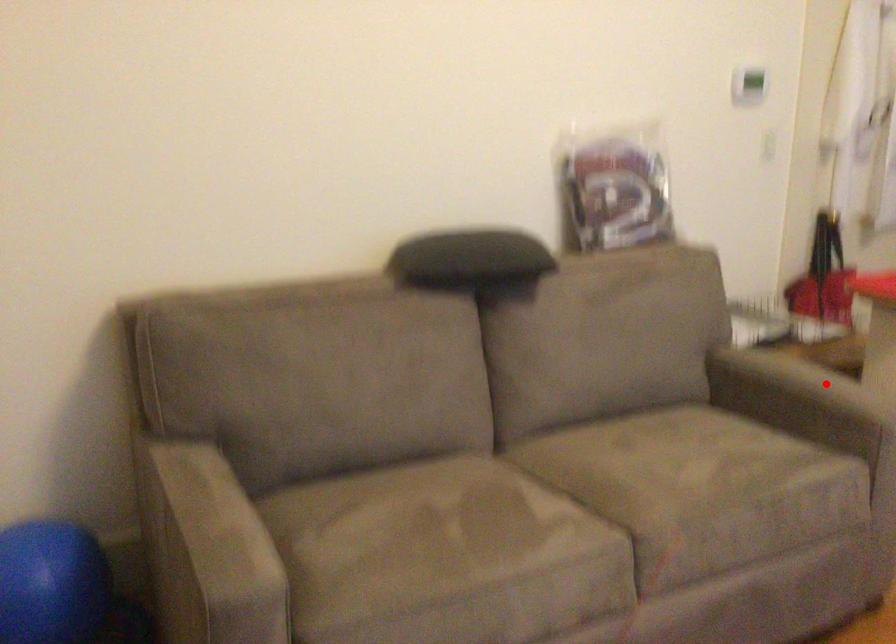
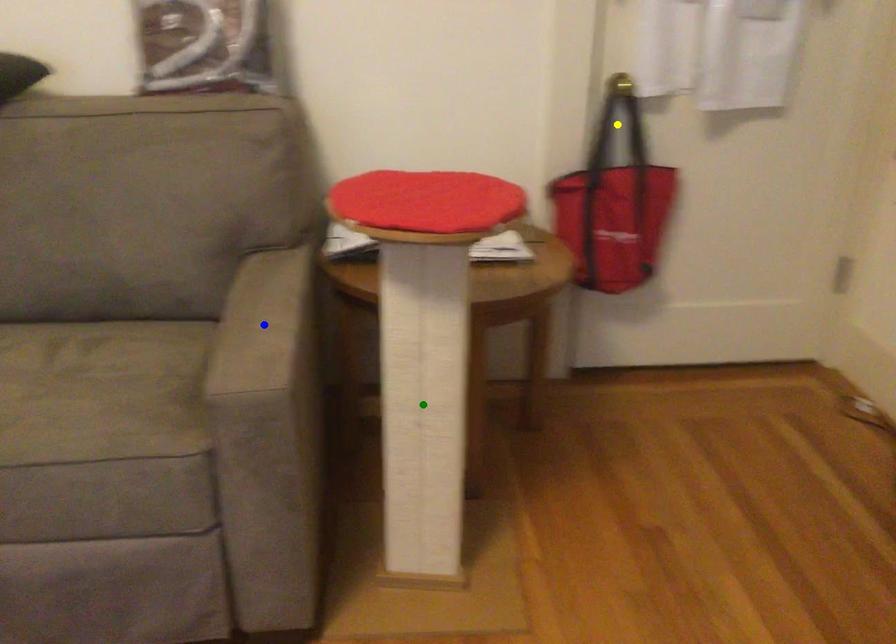
Question: I am providing you with two images of the same scene from different viewpoints. A red point is marked on the first image. You are given multiple points on the second image. Can you choose the point in image 2 that corresponds to the point in image 1?

Choices:
 (A) blue point
 (B) green point
 (C) yellow point

Answer: (A)